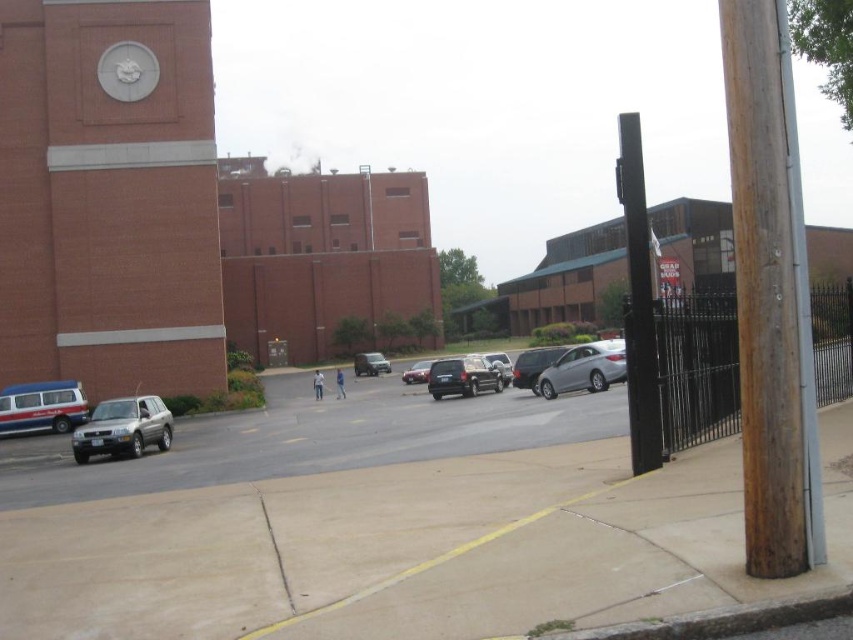
Between point (766, 572) and point (492, 369), which one is positioned behind?

Positioned behind is point (492, 369).

Which is below, brown wooden pole at right or shiny black suv at center?

shiny black suv at center

Between point (738, 32) and point (480, 380), which one is positioned in front?

Positioned in front is point (738, 32).

You are a GUI agent. You are given a task and a screenshot of the screen. Output one action in this format:
    pyautogui.click(x=<x>, y=<y>)
    Task: Click on the brown wooden pole at right
    This screenshot has width=853, height=640.
    Given the screenshot: What is the action you would take?
    pyautogui.click(x=770, y=296)

Can you confirm if brown wooden pole at right is positioned below black metal pole at right?

Incorrect, brown wooden pole at right is not positioned below black metal pole at right.

Between point (730, 61) and point (634, 406), which one is positioned behind?

The point (634, 406) is behind.

Who is more forward, (759, 484) or (637, 289)?

Positioned in front is point (759, 484).

The height and width of the screenshot is (640, 853). In order to click on brown wooden pole at right in this screenshot , I will do `click(770, 296)`.

Between point (500, 436) and point (132, 426), which one is positioned in front?

Point (500, 436) is more forward.

Which is below, silver metallic suv at lower left or satin silver suv at lower left?

silver metallic suv at lower left is lower down.

Which is in front, point (70, 493) or point (115, 429)?

Point (70, 493)

You are a GUI agent. You are given a task and a screenshot of the screen. Output one action in this format:
    pyautogui.click(x=<x>, y=<y>)
    Task: Click on the silver metallic suv at lower left
    This screenshot has width=853, height=640.
    Given the screenshot: What is the action you would take?
    pyautogui.click(x=312, y=438)